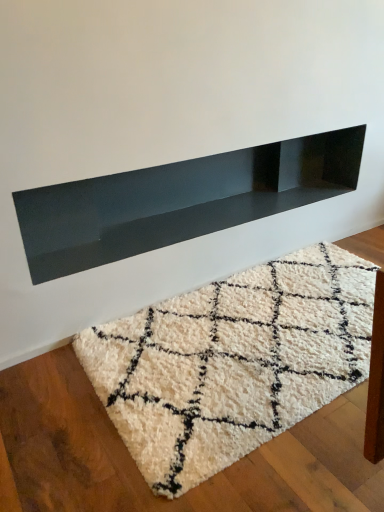
Image resolution: width=384 pixels, height=512 pixels. What are the coordinates of `free point above white shaggy rug at center (from a real-world perspective)` in the screenshot? It's located at (241, 367).